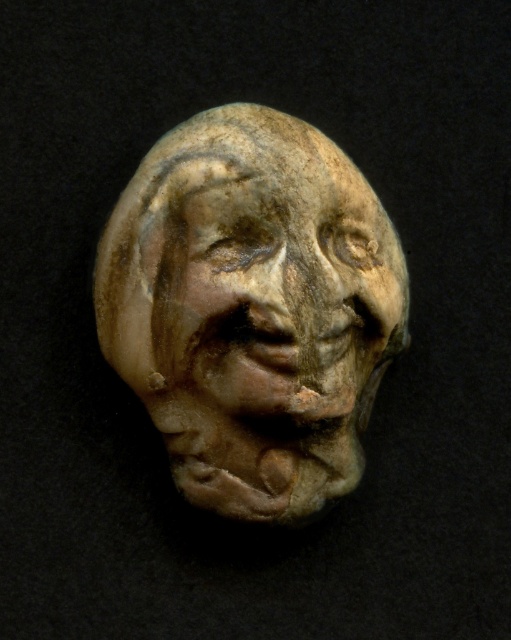
You are an art conservator examining the sculpture. You notice two items at the center of the image. Which one is closer to you, the matte clay bust at center or the earthenware mask at center?

The matte clay bust at center is closer to you because the earthenware mask at center is behind it.

You are an art restorer working on a sculpture. You have two items in front of you, the matte clay bust at center and the earthenware mask at center. Which one is wider?

The matte clay bust at center is wider than the earthenware mask at center.

You are an art conservator examining the sculpture. You notice two points on the sculpture, one at coordinate point (135, 182) and the other at point (353, 355). Which point is closer to the viewer?

Point (135, 182) is in front of point (353, 355), so the point at (135, 182) is closer to the viewer.